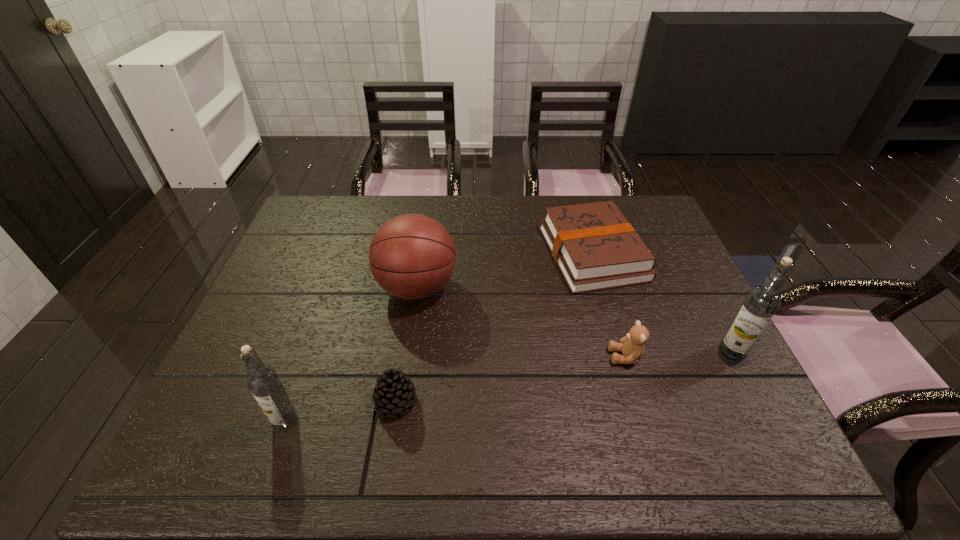
To make them evenly spaced by inserting another vodka among them, please locate a free space for this new vodka. Please provide its 2D coordinates. Your answer should be formatted as a tuple, i.e. [(x, y)], where the tuple contains the x and y coordinates of a point satisfying the conditions above.

[(523, 384)]